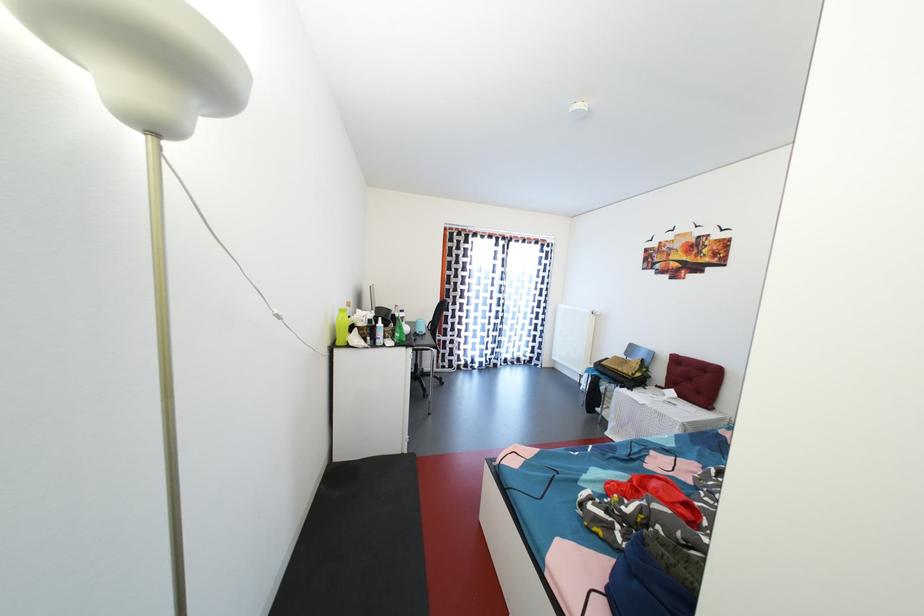
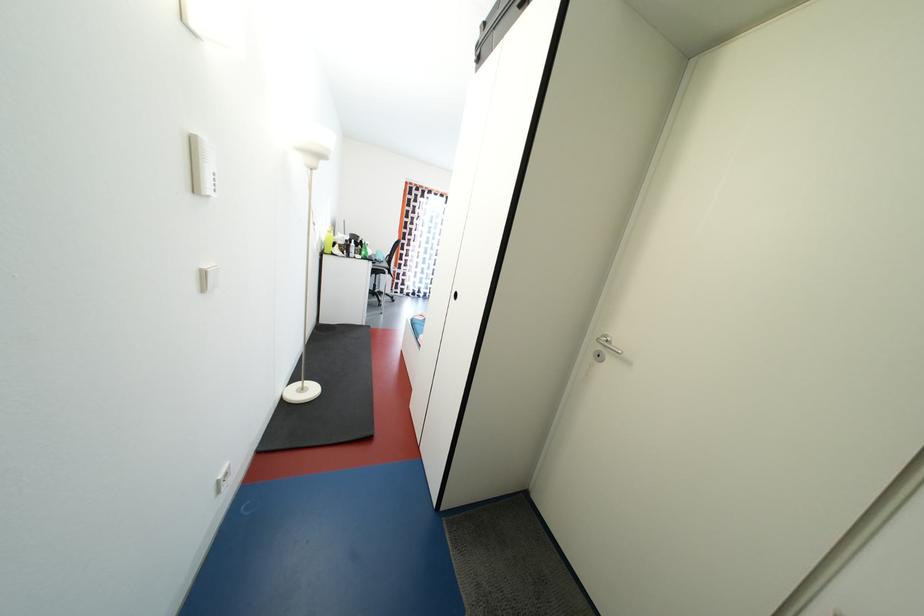
Question: In a continuous first-person perspective shot, in which direction is the camera moving?

Choices:
 (A) Left
 (B) Right
 (C) Forward
 (D) Backward

Answer: (D)